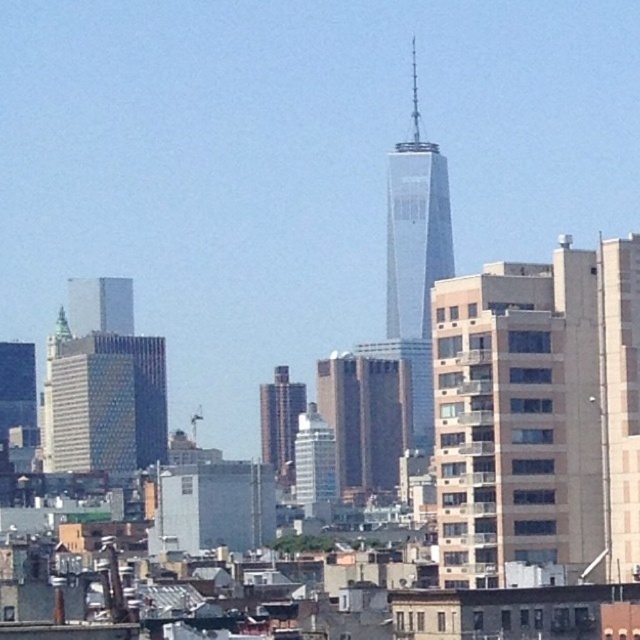
You are an urban planner analyzing the city layout. You need to determine which of the two buildings, the beige concrete building at right or the matte glass skyscraper at left, has a greater horizontal extent. Based on the scene, can you identify which one is wider?

The beige concrete building at right has a greater width than the matte glass skyscraper at left, as its width surpasses the latter.

You are a city planner analyzing the skyline. Given the beige concrete building at right and the matte glass skyscraper at left, which one is taller?

The beige concrete building at right is taller than the matte glass skyscraper at left according to the description.

You are a tourist standing in the city square and want to take a photo that includes both the smooth glass skyscraper at center and the brick textured building at center. Which building should you position closer to the front of your photo to ensure both are fully visible?

To ensure both the smooth glass skyscraper at center and the brick textured building at center are fully visible in your photo, you should position the brick textured building at center closer to the front. Since the smooth glass skyscraper at center is much taller, placing the shorter brick textured building at center in the foreground will help balance the composition and ensure both structures are captured in full without one overpowering the other.